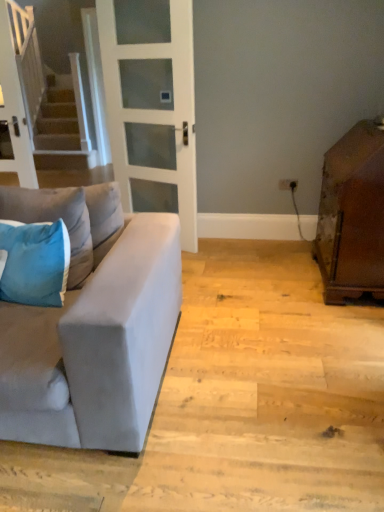
You are a GUI agent. You are given a task and a screenshot of the screen. Output one action in this format:
    pyautogui.click(x=<x>, y=<y>)
    Task: Click on the vacant area that lies between brown wooden cabinet at right and white frosted glass door at center
    The image size is (384, 512).
    Given the screenshot: What is the action you would take?
    pyautogui.click(x=252, y=265)